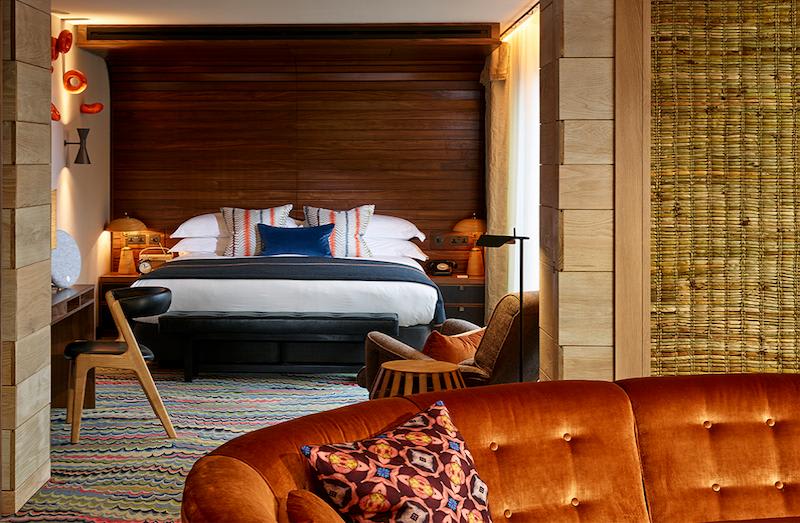
I want to click on ceiling, so click(x=280, y=11).